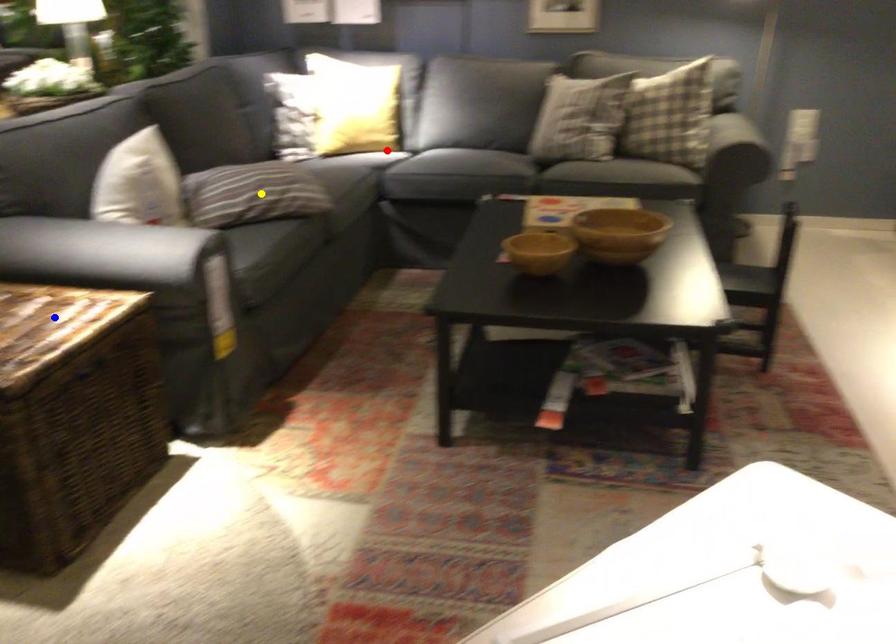
From the picture: Order these from nearest to farthest:
1. yellow point
2. red point
3. blue point

blue point → yellow point → red point